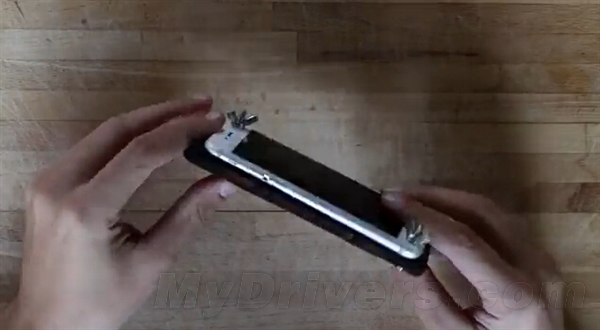
Find the location of a particular element. The height and width of the screenshot is (330, 600). phone is located at coordinates (315, 193).